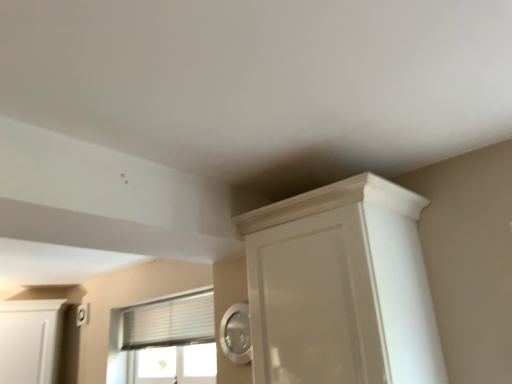
This screenshot has height=384, width=512. In order to click on white glossy cupboard at upper right in this screenshot , I will do `click(341, 287)`.

Is white glossy cupboard at upper right not near white matte cabinet at left?

Indeed, white glossy cupboard at upper right is not near white matte cabinet at left.

Is white glossy cupboard at upper right positioned behind white matte cabinet at left?

No, white glossy cupboard at upper right is in front of white matte cabinet at left.

From their relative heights in the image, would you say white glossy cupboard at upper right is taller or shorter than white matte cabinet at left?

white glossy cupboard at upper right is taller than white matte cabinet at left.

Which is closer to the camera, (190, 340) or (412, 244)?

Point (190, 340).

Is white textured window at center surrounding white glossy cupboard at upper right?

That's incorrect, white glossy cupboard at upper right is not inside white textured window at center.

Identify the location of cupboard on the right of white textured window at center. (341, 287).

Is there a large distance between white textured window at center and white glossy cupboard at upper right?

Yes.

Does white textured window at center come in front of white matte cabinet at left?

Yes, the depth of white textured window at center is less than that of white matte cabinet at left.

Could you tell me if white textured window at center is turned towards white matte cabinet at left?

No.

You are a GUI agent. You are given a task and a screenshot of the screen. Output one action in this format:
    pyautogui.click(x=<x>, y=<y>)
    Task: Click on the cabinetry behind the white textured window at center
    The image size is (512, 384).
    Given the screenshot: What is the action you would take?
    pyautogui.click(x=30, y=340)

This screenshot has height=384, width=512. I want to click on cupboard in front of the white textured window at center, so click(341, 287).

Is white glossy cupboard at upper right wider or thinner than white textured window at center?

In the image, white glossy cupboard at upper right appears to be wider than white textured window at center.

What's the angular difference between white glossy cupboard at upper right and white textured window at center's facing directions?

white glossy cupboard at upper right and white textured window at center are facing 1.74 degrees away from each other.

Does white glossy cupboard at upper right have a lesser height compared to white textured window at center?

Incorrect, the height of white glossy cupboard at upper right does not fall short of that of white textured window at center.

In the image, is white matte cabinet at left on the left side or the right side of white textured window at center?

white matte cabinet at left is to the left of white textured window at center.

Is white matte cabinet at left looking in the opposite direction of white textured window at center?

white matte cabinet at left does not have its back to white textured window at center.

Based on the photo, is white matte cabinet at left positioned far away from white textured window at center?

No, white matte cabinet at left is not far away from white textured window at center.

What's the angular difference between white matte cabinet at left and white textured window at center's facing directions?

The angle between the facing direction of white matte cabinet at left and the facing direction of white textured window at center is 56.9 degrees.

Which is more to the left, white matte cabinet at left or white glossy cupboard at upper right?

white matte cabinet at left is more to the left.

Based on their sizes in the image, would you say white matte cabinet at left is bigger or smaller than white glossy cupboard at upper right?

white matte cabinet at left is smaller than white glossy cupboard at upper right.

Considering their positions, is white matte cabinet at left located in front of or behind white glossy cupboard at upper right?

white matte cabinet at left is positioned farther from the viewer than white glossy cupboard at upper right.

From a real-world perspective, is white matte cabinet at left above or below white glossy cupboard at upper right?

From a real-world perspective, white matte cabinet at left is physically below white glossy cupboard at upper right.

Identify the location of cabinetry beneath the white glossy cupboard at upper right (from a real-world perspective). (30, 340).

You are a GUI agent. You are given a task and a screenshot of the screen. Output one action in this format:
    pyautogui.click(x=<x>, y=<y>)
    Task: Click on the window on the left side of white glossy cupboard at upper right
    The image size is (512, 384).
    Given the screenshot: What is the action you would take?
    pos(164,340)

Based on the photo, estimate the real-world distances between objects in this image. Which object is closer to white textured window at center, white glossy cupboard at upper right or white matte cabinet at left?

white matte cabinet at left lies closer to white textured window at center than the other object.

When comparing their distances from white matte cabinet at left, does white textured window at center or white glossy cupboard at upper right seem closer?

Based on the image, white textured window at center appears to be nearer to white matte cabinet at left.

When comparing their distances from white matte cabinet at left, does white glossy cupboard at upper right or white textured window at center seem closer?

white textured window at center is positioned closer to the anchor white matte cabinet at left.

Based on their spatial positions, is white matte cabinet at left or white textured window at center further from white glossy cupboard at upper right?

Based on the image, white matte cabinet at left appears to be further to white glossy cupboard at upper right.

From the image, which object appears to be farther from white glossy cupboard at upper right, white textured window at center or white matte cabinet at left?

white matte cabinet at left lies further to white glossy cupboard at upper right than the other object.

Looking at this image, which object lies further to the anchor point white textured window at center, white matte cabinet at left or white glossy cupboard at upper right?

white glossy cupboard at upper right.

Identify the location of window located between white matte cabinet at left and white glossy cupboard at upper right in the left-right direction. This screenshot has height=384, width=512. (164, 340).